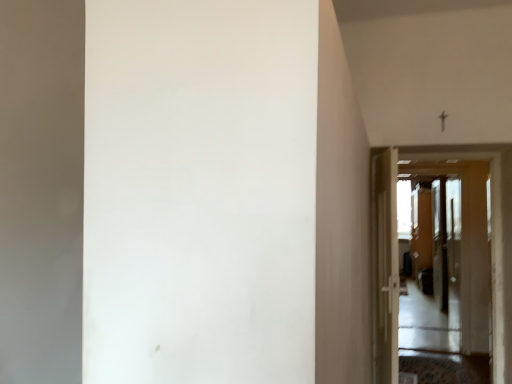
Question: Is transparent glass screen door at center, which is the 1th screen door from front to back, a part of white glossy door at center, marked as the first door in a right-to-left arrangement?

Choices:
 (A) no
 (B) yes

Answer: (A)

Question: Does white glossy door at center, the second door positioned from the left, have a larger size compared to transparent glass screen door at center, which is the 1th screen door from front to back?

Choices:
 (A) no
 (B) yes

Answer: (A)

Question: Would you say white glossy door at center, marked as the first door in a right-to-left arrangement, is a long distance from transparent glass screen door at center, which is the 1th screen door from front to back?

Choices:
 (A) no
 (B) yes

Answer: (A)

Question: From the image's perspective, is white glossy door at center, the second door positioned from the left, above transparent glass screen door at center, the 1th screen door from the left?

Choices:
 (A) no
 (B) yes

Answer: (B)

Question: Considering the relative positions of white glossy door at center, the second door positioned from the left, and transparent glass screen door at center, which is the 2th screen door from right to left, in the image provided, is white glossy door at center, the second door positioned from the left, to the right of transparent glass screen door at center, which is the 2th screen door from right to left, from the viewer's perspective?

Choices:
 (A) no
 (B) yes

Answer: (A)

Question: Does white glossy door at center, marked as the first door in a right-to-left arrangement, lie behind transparent glass screen door at center, positioned as the 2th screen door in back-to-front order?

Choices:
 (A) yes
 (B) no

Answer: (B)

Question: Considering the relative positions of white glossy door at right, the 2th door in the right-to-left sequence, and transparent plastic screen door at right, acting as the first screen door starting from the right, in the image provided, is white glossy door at right, the 2th door in the right-to-left sequence, to the right of transparent plastic screen door at right, acting as the first screen door starting from the right, from the viewer's perspective?

Choices:
 (A) yes
 (B) no

Answer: (B)

Question: From a real-world perspective, is white glossy door at right, the 1th door viewed from the left, below transparent plastic screen door at right, which is the first screen door from back to front?

Choices:
 (A) no
 (B) yes

Answer: (A)

Question: Is white glossy door at right, the 1th door viewed from the left, positioned beyond the bounds of transparent plastic screen door at right, which is the first screen door from back to front?

Choices:
 (A) yes
 (B) no

Answer: (A)

Question: Does white glossy door at right, the 1th door viewed from the left, have a greater width compared to transparent plastic screen door at right, acting as the first screen door starting from the right?

Choices:
 (A) no
 (B) yes

Answer: (A)

Question: Could you tell me if white glossy door at right, the 2th door in the right-to-left sequence, is turned towards transparent plastic screen door at right, positioned as the 2th screen door in front-to-back order?

Choices:
 (A) yes
 (B) no

Answer: (B)

Question: From the image's perspective, would you say white glossy door at right, the 2th door in the right-to-left sequence, is shown under transparent plastic screen door at right, which is the first screen door from back to front?

Choices:
 (A) no
 (B) yes

Answer: (A)

Question: Is white glossy door at center, marked as the first door in a right-to-left arrangement, at the left side of white glossy door at right, the 1th door viewed from the left?

Choices:
 (A) no
 (B) yes

Answer: (A)